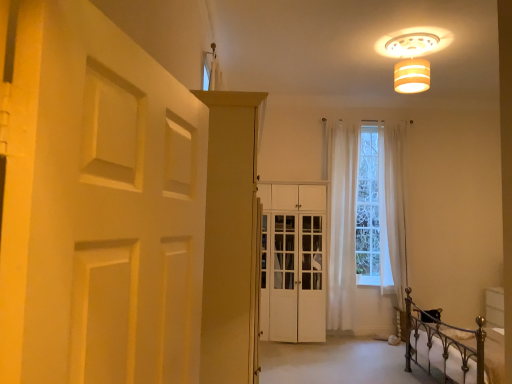
Question: Considering the positions of white matte door at left and white sheer curtain at center, the 1th curtain in the left-to-right sequence, in the image, is white matte door at left taller or shorter than white sheer curtain at center, the 1th curtain in the left-to-right sequence,?

Choices:
 (A) short
 (B) tall

Answer: (A)

Question: Is white matte door at left wider or thinner than white sheer curtain at center, marked as the second curtain in a right-to-left arrangement?

Choices:
 (A) thin
 (B) wide

Answer: (A)

Question: Which of these objects is positioned closest to the matte beige cylindrical lampshade at upper right?

Choices:
 (A) white matte door at left
 (B) metallic wrought iron bed at lower right
 (C) matte white cabinet at center, the second door in the back-to-front sequence
 (D) white wood cabinet at center, positioned as the first door in right-to-left order
 (E) white sheer curtain at center, the 1th curtain when ordered from right to left

Answer: (E)

Question: Considering the real-world distances, which object is farthest from the matte white cabinet at center, the first door when ordered from left to right?

Choices:
 (A) matte beige cylindrical lampshade at upper right
 (B) white matte door at left
 (C) metallic wrought iron bed at lower right
 (D) white sheer curtain at center, arranged as the 2th curtain when viewed from the left
 (E) white wood cabinet at center, which is the 2th door from front to back

Answer: (D)